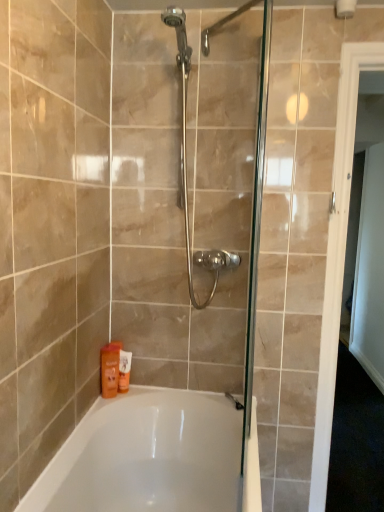
Question: Does point (102, 356) appear closer or farther from the camera than point (122, 392)?

Choices:
 (A) farther
 (B) closer

Answer: (B)

Question: Relative to orange matte lotion at lower left, the first toiletry viewed from the back, is orange matte bottle at lower left, which ranks as the second toiletry in back-to-front order, in front or behind?

Choices:
 (A) front
 (B) behind

Answer: (A)

Question: Which is nearer to the orange matte lotion at lower left, arranged as the 2th toiletry when viewed from the front?

Choices:
 (A) white glossy door at right
 (B) white glossy bathtub at lower center
 (C) orange matte bottle at lower left, which is counted as the first toiletry, starting from the front

Answer: (C)

Question: Considering the real-world distances, which object is closest to the white glossy door at right?

Choices:
 (A) white glossy bathtub at lower center
 (B) orange matte lotion at lower left, the first toiletry viewed from the back
 (C) orange matte bottle at lower left, which ranks as the second toiletry in back-to-front order

Answer: (A)